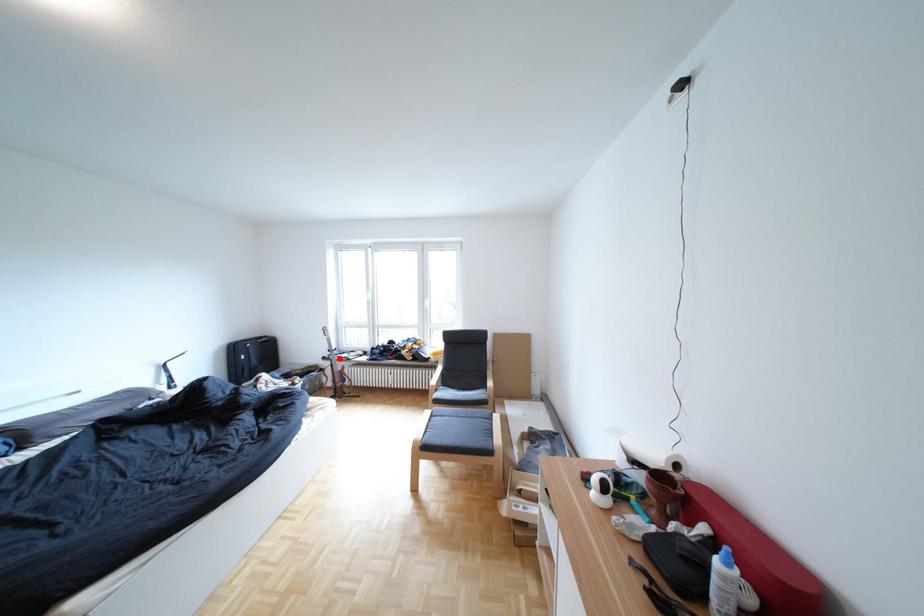
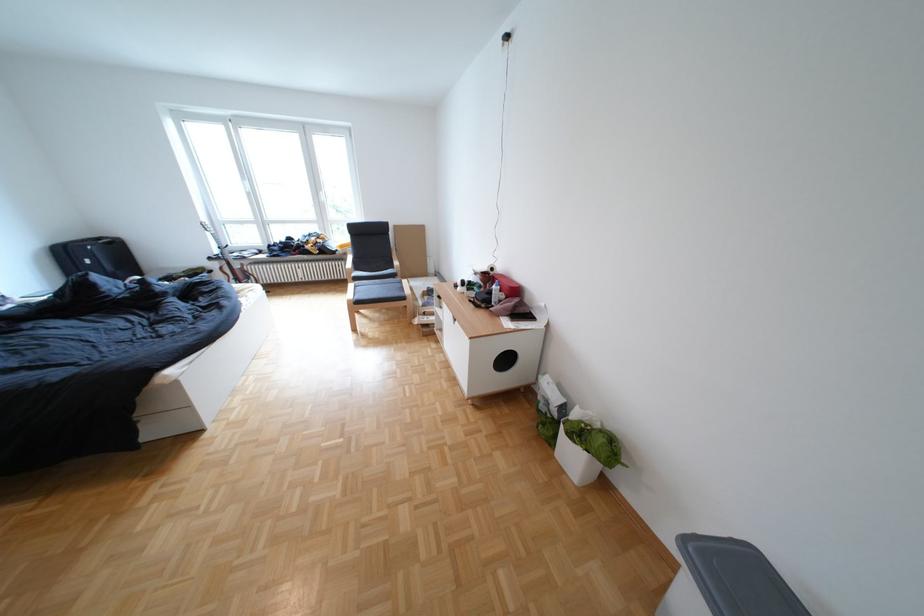
The point at the highlighted location is marked in the first image. Where is the corresponding point in the second image?

(225, 259)